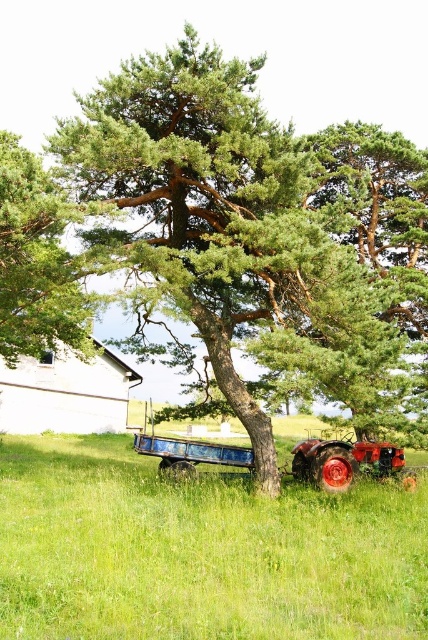
Question: Which object is the farthest from the green grassy field at lower center?

Choices:
 (A) green leafy tree at center
 (B) green needle-like leaves at upper center
 (C) shiny red tractor at center

Answer: (A)

Question: Among these points, which one is nearest to the camera?

Choices:
 (A) (347, 445)
 (B) (148, 88)

Answer: (B)

Question: In this image, where is green grassy field at lower center located relative to shiny red tractor at center?

Choices:
 (A) above
 (B) below

Answer: (B)

Question: From the image, what is the correct spatial relationship of green leafy tree at center in relation to green grassy field at lower center?

Choices:
 (A) below
 (B) above

Answer: (B)

Question: Is green needle-like leaves at upper center positioned behind shiny red tractor at center?

Choices:
 (A) no
 (B) yes

Answer: (A)

Question: Which of the following is the farthest from the observer?

Choices:
 (A) (73, 532)
 (B) (351, 477)
 (C) (342, 276)

Answer: (B)